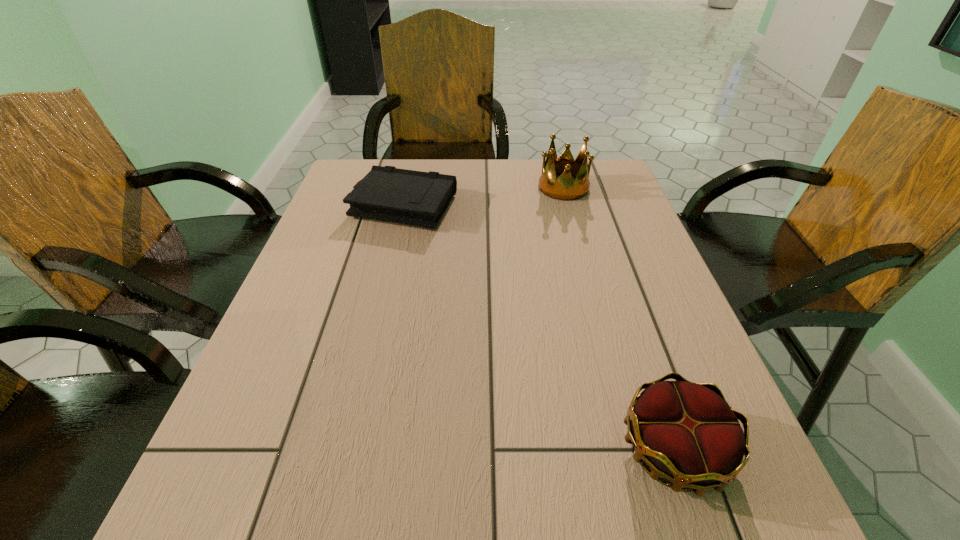
Identify the location of vacant point located between the nearer crown and the leftmost object. This screenshot has height=540, width=960. (539, 327).

Image resolution: width=960 pixels, height=540 pixels. I want to click on unoccupied position between the shorter crown and the tallest object, so click(x=619, y=318).

Find the location of a particular element. This screenshot has width=960, height=540. free spot between the nearest object and the tallest object is located at coordinates (x=619, y=318).

Locate an element on the screen. Image resolution: width=960 pixels, height=540 pixels. object that is the second nearest to the nearest object is located at coordinates (564, 188).

Locate an element on the screen. This screenshot has width=960, height=540. the closest object to the tallest object is located at coordinates (387, 193).

I want to click on vacant position in the image that satisfies the following two spatial constraints: 1. on the front side of the tallest object; 2. on the left side of the nearest object, so click(x=635, y=449).

Locate an element on the screen. This screenshot has height=540, width=960. vacant space that satisfies the following two spatial constraints: 1. on the front side of the shorter crown; 2. on the right side of the tallest object is located at coordinates (635, 449).

Identify the location of vacant space that satisfies the following two spatial constraints: 1. on the front side of the farther crown; 2. on the right side of the shorter crown. The width and height of the screenshot is (960, 540). (635, 449).